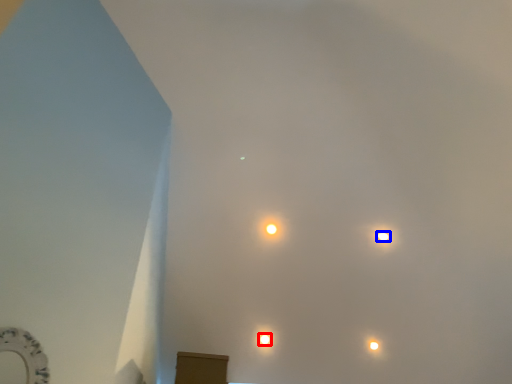
Question: Which object is further to the camera taking this photo, lamp (highlighted by a red box) or lamp (highlighted by a blue box)?

Choices:
 (A) lamp
 (B) lamp

Answer: (A)